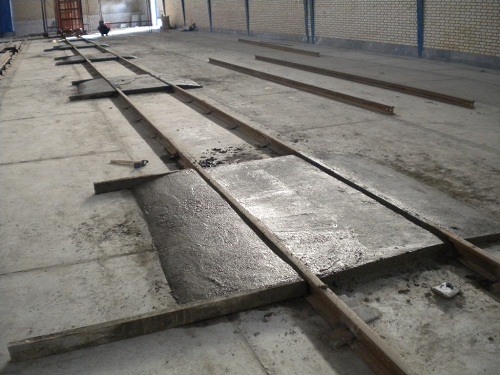
Locate an element on the screen. The height and width of the screenshot is (375, 500). open door is located at coordinates (160, 11).